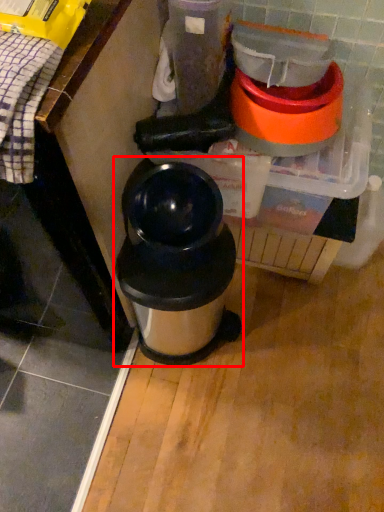
Question: Where is waste container (annotated by the red box) located in relation to blender in the image?

Choices:
 (A) left
 (B) right

Answer: (A)